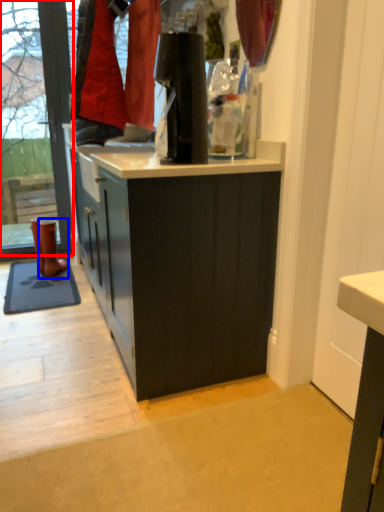
Question: Which object is further to the camera taking this photo, shop window (highlighted by a red box) or footwear (highlighted by a blue box)?

Choices:
 (A) shop window
 (B) footwear

Answer: (B)